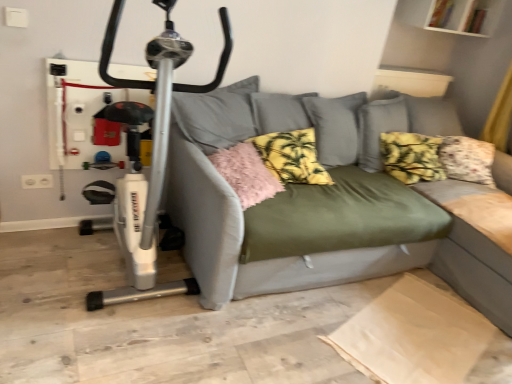
Question: Which direction should I rotate to look at yellow printed fabric pillow at center, which ranks as the second pillow in right-to-left order?

Choices:
 (A) left
 (B) right

Answer: (B)

Question: Is pink fluffy pillow at center, arranged as the 3th pillow when viewed from the right, thinner than yellow floral cushion at center, which ranks as the first pillow in right-to-left order?

Choices:
 (A) no
 (B) yes

Answer: (A)

Question: Does pink fluffy pillow at center, arranged as the 3th pillow when viewed from the right, have a lesser height compared to yellow floral cushion at center, which is counted as the third pillow, starting from the left?

Choices:
 (A) no
 (B) yes

Answer: (B)

Question: Is pink fluffy pillow at center, arranged as the 3th pillow when viewed from the right, to the left of yellow floral cushion at center, which is counted as the third pillow, starting from the left, from the viewer's perspective?

Choices:
 (A) yes
 (B) no

Answer: (A)

Question: Does pink fluffy pillow at center, arranged as the 3th pillow when viewed from the right, come in front of yellow floral cushion at center, which ranks as the first pillow in right-to-left order?

Choices:
 (A) yes
 (B) no

Answer: (A)

Question: From the image's perspective, does pink fluffy pillow at center, which ranks as the first pillow in left-to-right order, appear higher than yellow floral cushion at center, which is counted as the third pillow, starting from the left?

Choices:
 (A) no
 (B) yes

Answer: (A)

Question: Is pink fluffy pillow at center, which ranks as the first pillow in left-to-right order, turned away from yellow floral cushion at center, which ranks as the first pillow in right-to-left order?

Choices:
 (A) yes
 (B) no

Answer: (B)

Question: Can you confirm if olive green fabric couch at center is shorter than white plastic exercise bike at left?

Choices:
 (A) yes
 (B) no

Answer: (A)

Question: Considering the relative sizes of olive green fabric couch at center and white plastic exercise bike at left in the image provided, is olive green fabric couch at center thinner than white plastic exercise bike at left?

Choices:
 (A) yes
 (B) no

Answer: (B)

Question: Can you confirm if olive green fabric couch at center is positioned to the right of white plastic exercise bike at left?

Choices:
 (A) yes
 (B) no

Answer: (A)

Question: Is olive green fabric couch at center turned away from white plastic exercise bike at left?

Choices:
 (A) yes
 (B) no

Answer: (B)

Question: Is olive green fabric couch at center outside white plastic exercise bike at left?

Choices:
 (A) no
 (B) yes

Answer: (B)

Question: From the image's perspective, is olive green fabric couch at center below white plastic exercise bike at left?

Choices:
 (A) no
 (B) yes

Answer: (B)

Question: Is white plastic exercise bike at left surrounding yellow floral cushion at center, which is counted as the third pillow, starting from the left?

Choices:
 (A) yes
 (B) no

Answer: (B)